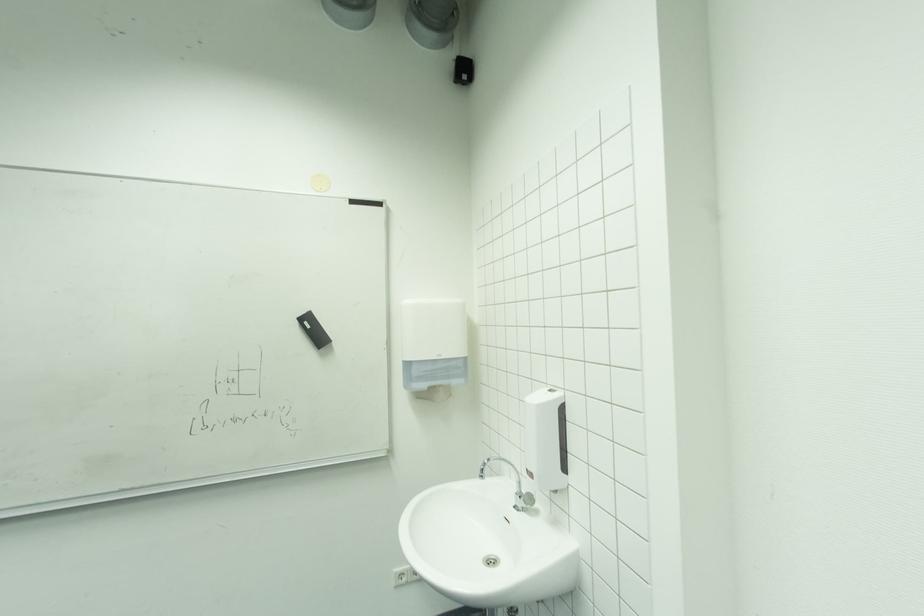
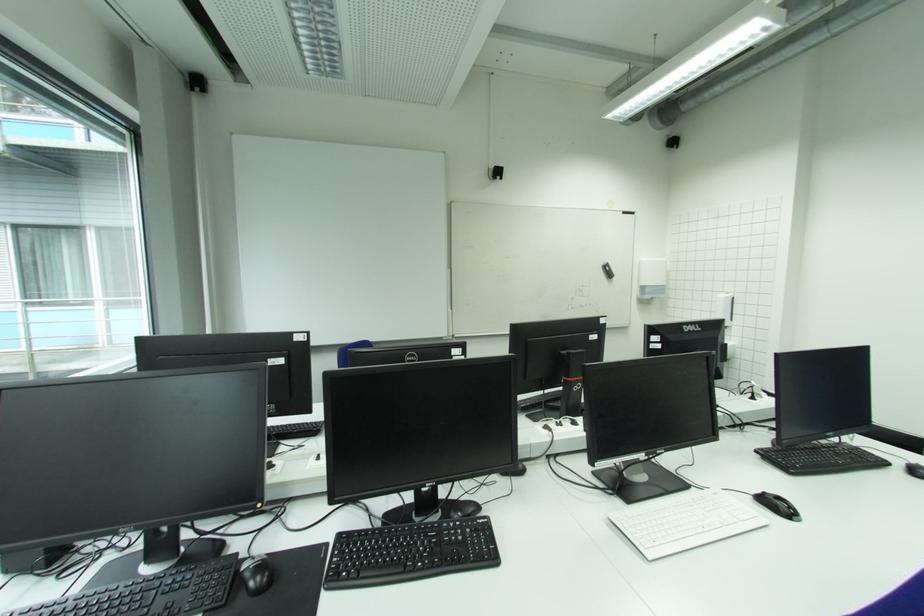
What movement of the cameraman would produce the second image?

The movement direction of the cameraman is left, backward.